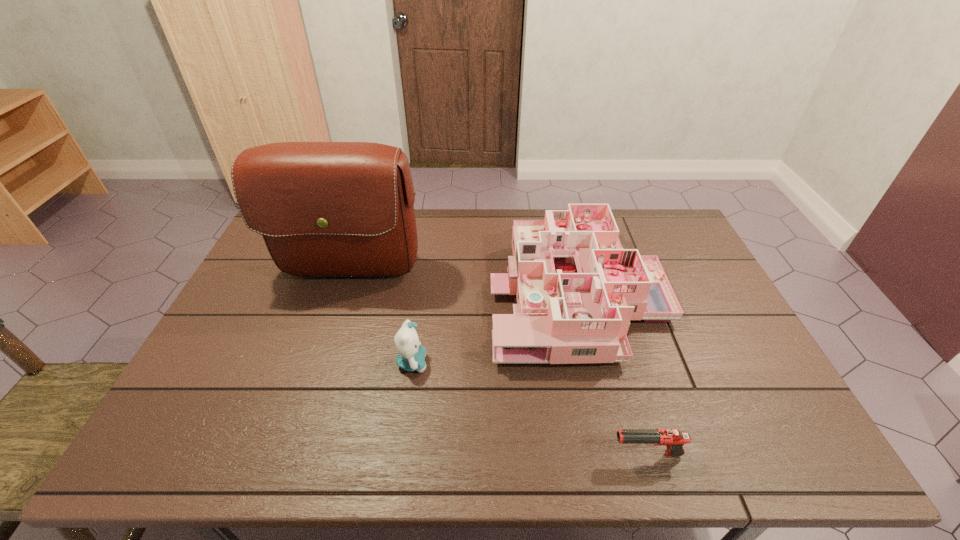
Identify the location of the tallest object. The height and width of the screenshot is (540, 960). (325, 209).

This screenshot has height=540, width=960. What are the coordinates of `the third shortest object` in the screenshot? It's located at (577, 289).

The height and width of the screenshot is (540, 960). Find the location of `the third tallest object`. the third tallest object is located at coordinates (411, 357).

The image size is (960, 540). What are the coordinates of `the shortest object` in the screenshot? It's located at (674, 440).

Find the location of a particular element. This screenshot has height=540, width=960. the nearest object is located at coordinates (674, 440).

The height and width of the screenshot is (540, 960). What are the coordinates of `free location located on the open flap of the satchel` in the screenshot? It's located at (313, 392).

Where is `free spot located at the front entrance of the third shortest object`? This screenshot has height=540, width=960. free spot located at the front entrance of the third shortest object is located at coordinates (462, 293).

Locate an element on the screen. This screenshot has width=960, height=540. vacant region located 0.400m at the front entrance of the third shortest object is located at coordinates (362, 293).

The width and height of the screenshot is (960, 540). I want to click on blank space located at the front entrance of the third shortest object, so [x=362, y=293].

This screenshot has height=540, width=960. Identify the location of vacant space located 0.230m on the face of the second shortest object. (515, 363).